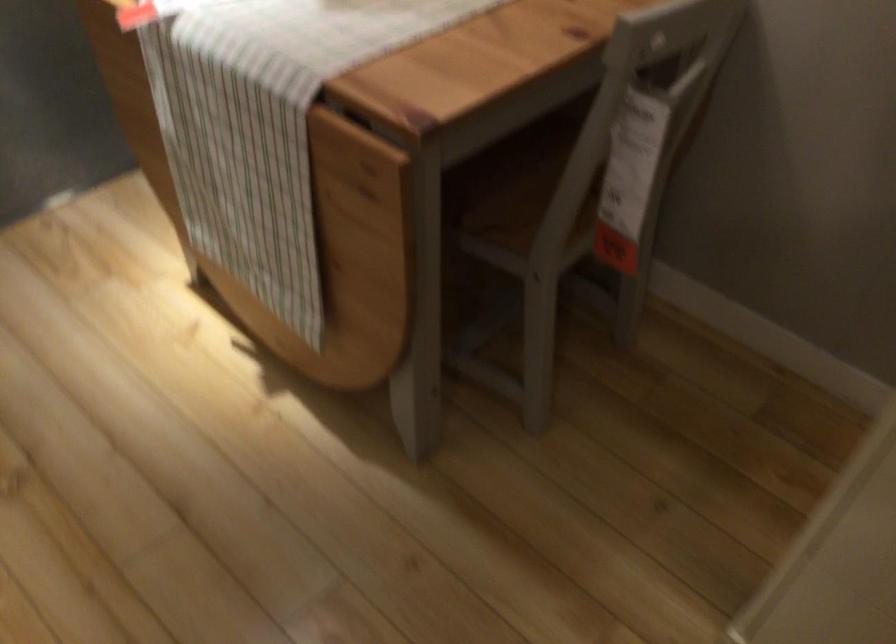
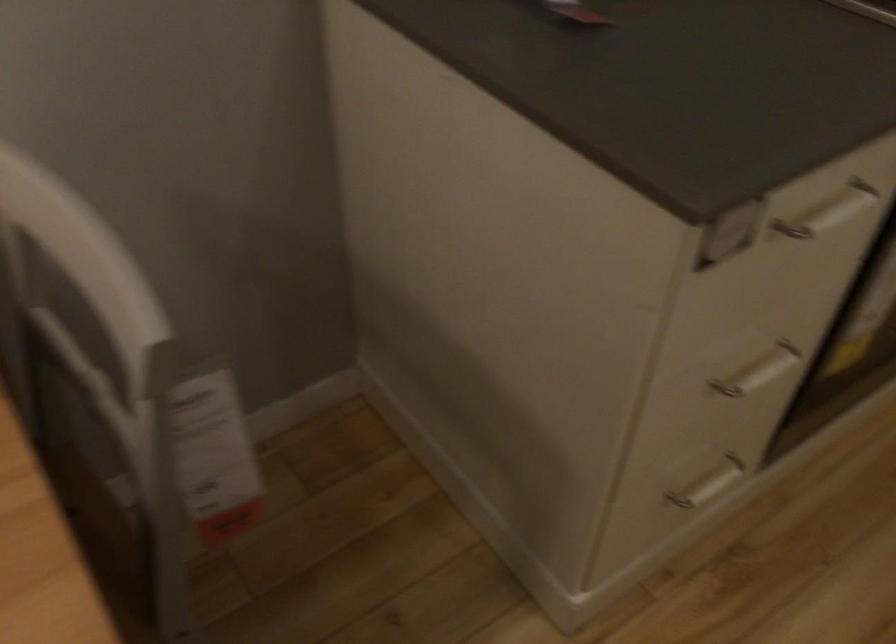
First-person continuous shooting, in which direction is the camera rotating?

The camera rotated toward right-down.